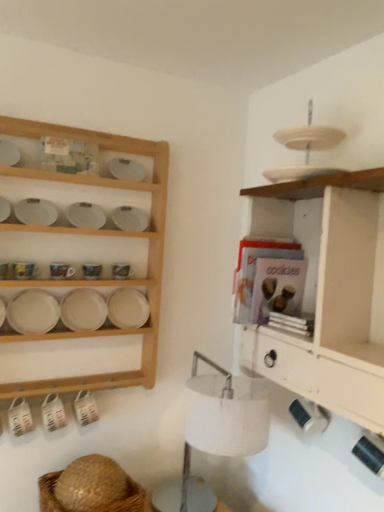
Question: From a real-world perspective, is white matte platter at left positioned above or below white wood shelf at right, the second shelf when ordered from left to right?

Choices:
 (A) below
 (B) above

Answer: (A)

Question: Considering the positions of white matte platter at left and white wood shelf at right, the first shelf viewed from the right, in the image, is white matte platter at left wider or thinner than white wood shelf at right, the first shelf viewed from the right,?

Choices:
 (A) wide
 (B) thin

Answer: (B)

Question: Which object is the closest to the white wood shelf at upper left, the first shelf from the left?

Choices:
 (A) white wood shelf at right, the first shelf viewed from the right
 (B) white fabric lampshade at center
 (C) white matte platter at left
 (D) brown woven basket at lower left

Answer: (C)

Question: Which object is the closest to the white wood shelf at upper left, the 2th shelf viewed from the right?

Choices:
 (A) white wood shelf at right, the second shelf when ordered from left to right
 (B) white fabric lampshade at center
 (C) white matte platter at left
 (D) brown woven basket at lower left

Answer: (C)